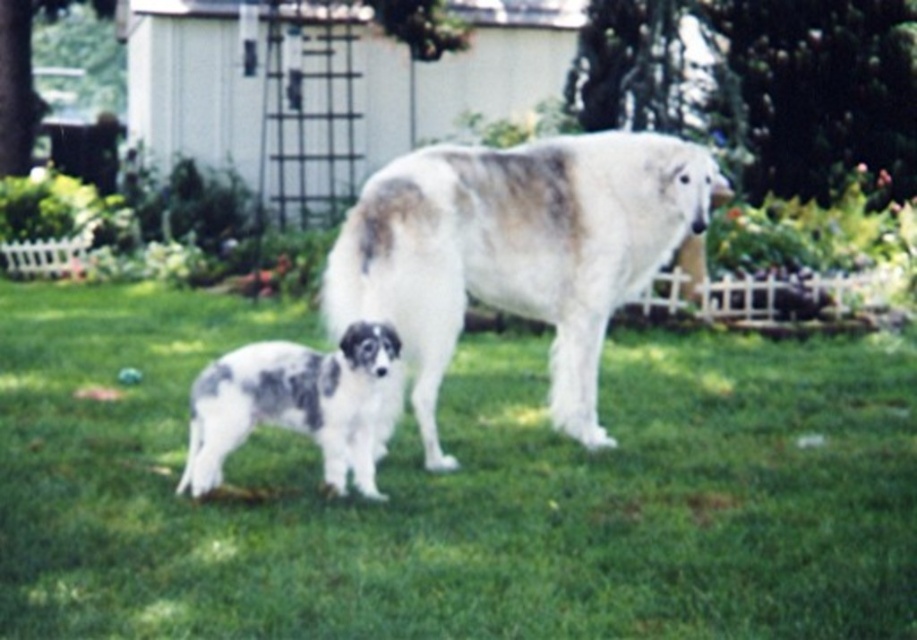
Who is taller, green grass at center or spotted fur puppy at lower left?

spotted fur puppy at lower left

Can you confirm if green grass at center is bigger than spotted fur puppy at lower left?

Yes.

Identify the location of green grass at center. (456, 490).

Which is above, green grass at center or white fur dog at center?

white fur dog at center is above.

Can you confirm if green grass at center is positioned above white fur dog at center?

No.

Does point (197, 346) come behind point (558, 228)?

Yes, point (197, 346) is farther from viewer.

The height and width of the screenshot is (640, 917). Identify the location of green grass at center. (456, 490).

In the scene shown: Who is taller, white fur dog at center or spotted fur puppy at lower left?

With more height is white fur dog at center.

Does white fur dog at center appear under spotted fur puppy at lower left?

Actually, white fur dog at center is above spotted fur puppy at lower left.

Is point (599, 211) behind point (380, 374)?

Yes, it is behind point (380, 374).

Where is `white fur dog at center`? The width and height of the screenshot is (917, 640). white fur dog at center is located at coordinates (514, 253).